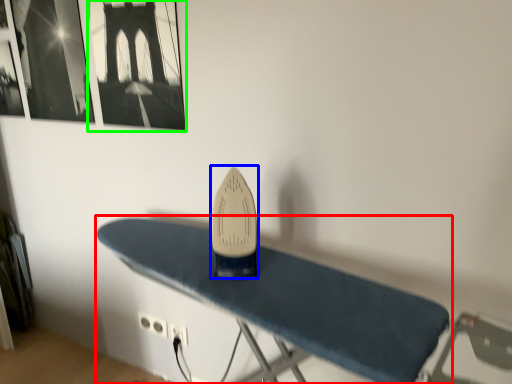
Question: Which object is the farthest from furniture (highlighted by a red box)? Choose among these: surfboard (highlighted by a blue box) or picture frame (highlighted by a green box).

Choices:
 (A) surfboard
 (B) picture frame

Answer: (B)